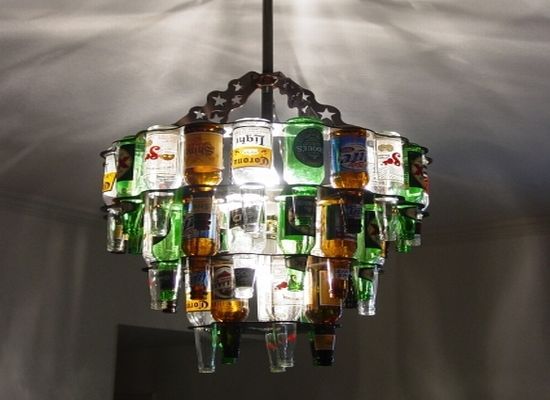
Where is `doorway`? The width and height of the screenshot is (550, 400). doorway is located at coordinates (161, 387).